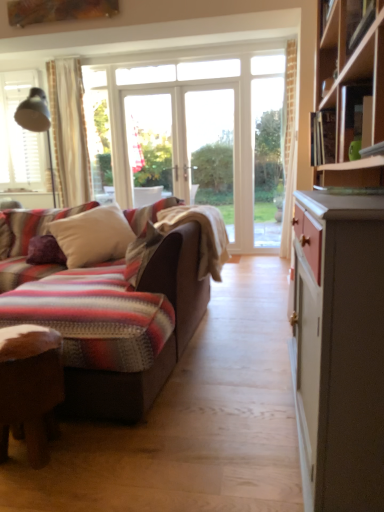
Describe the element at coordinates (93, 236) in the screenshot. I see `white soft pillow at center, the second pillow in the left-to-right sequence` at that location.

What do you see at coordinates (45, 251) in the screenshot? I see `purple velvet pillow at left, placed as the first pillow when sorted from left to right` at bounding box center [45, 251].

Measure the distance between point (x=51, y=258) and camera.

Point (x=51, y=258) is 3.05 meters away from camera.

The width and height of the screenshot is (384, 512). I want to click on striped woolen blanket at center, so click(x=201, y=234).

What is the approximate width of striped woolen blanket at center?

22.66 inches.

Identify the location of white soft pillow at center, acting as the 1th pillow starting from the right. This screenshot has height=512, width=384. (93, 236).

Is wooden desk at lower left further to the viewer compared to white soft pillow at center, the second pillow in the left-to-right sequence?

No, it is in front of white soft pillow at center, the second pillow in the left-to-right sequence.

Is white soft pillow at center, the second pillow in the left-to-right sequence, at the back of wooden desk at lower left?

Yes, wooden desk at lower left is positioned with its back facing white soft pillow at center, the second pillow in the left-to-right sequence.

Based on their sizes in the image, would you say wooden desk at lower left is bigger or smaller than white soft pillow at center, acting as the 1th pillow starting from the right?

Clearly, wooden desk at lower left is smaller in size than white soft pillow at center, acting as the 1th pillow starting from the right.

Is white soft pillow at center, acting as the 1th pillow starting from the right, completely or partially inside wooden desk at lower left?

No, white soft pillow at center, acting as the 1th pillow starting from the right, is not a part of wooden desk at lower left.

Between point (214, 215) and point (111, 231), which one is positioned behind?

Point (111, 231)

From the image's perspective, is striped woolen blanket at center located above or below white soft pillow at center, the second pillow in the left-to-right sequence?

Clearly, from the image's perspective, striped woolen blanket at center is below white soft pillow at center, the second pillow in the left-to-right sequence.

Is striped woolen blanket at center taller or shorter than white soft pillow at center, the second pillow in the left-to-right sequence?

striped woolen blanket at center is shorter than white soft pillow at center, the second pillow in the left-to-right sequence.

In the scene shown: Would you say striped woolen blanket at center is to the left or to the right of white soft pillow at center, the second pillow in the left-to-right sequence, in the picture?

From the image, it's evident that striped woolen blanket at center is to the right of white soft pillow at center, the second pillow in the left-to-right sequence.

Considering the sizes of objects wooden desk at lower left and purple velvet pillow at left, arranged as the second pillow when viewed from the right, in the image provided, who is thinner, wooden desk at lower left or purple velvet pillow at left, arranged as the second pillow when viewed from the right,?

wooden desk at lower left.

In the image, is wooden desk at lower left positioned in front of or behind purple velvet pillow at left, placed as the first pillow when sorted from left to right?

In the image, wooden desk at lower left appears in front of purple velvet pillow at left, placed as the first pillow when sorted from left to right.

Is wooden desk at lower left next to purple velvet pillow at left, placed as the first pillow when sorted from left to right?

No, wooden desk at lower left is not beside purple velvet pillow at left, placed as the first pillow when sorted from left to right.

Is wooden desk at lower left taller than purple velvet pillow at left, placed as the first pillow when sorted from left to right?

Indeed, wooden desk at lower left has a greater height compared to purple velvet pillow at left, placed as the first pillow when sorted from left to right.

Is purple velvet pillow at left, arranged as the second pillow when viewed from the right, not close to wooden desk at lower left?

Yes, purple velvet pillow at left, arranged as the second pillow when viewed from the right, is far from wooden desk at lower left.

Is purple velvet pillow at left, placed as the first pillow when sorted from left to right, positioned with its back to wooden desk at lower left?

purple velvet pillow at left, placed as the first pillow when sorted from left to right, does not have its back to wooden desk at lower left.

Where is `desk lying in front of the purple velvet pillow at left, arranged as the second pillow when viewed from the right`? This screenshot has width=384, height=512. desk lying in front of the purple velvet pillow at left, arranged as the second pillow when viewed from the right is located at coordinates (29, 387).

Based on the photo, which is correct: purple velvet pillow at left, arranged as the second pillow when viewed from the right, is inside wooden desk at lower left, or outside of it?

purple velvet pillow at left, arranged as the second pillow when viewed from the right, is not enclosed by wooden desk at lower left.

Is striped woolen blanket at center at the right side of wooden desk at lower left?

Correct, you'll find striped woolen blanket at center to the right of wooden desk at lower left.

How distant is striped woolen blanket at center from wooden desk at lower left?

1.18 meters.

Who is shorter, striped woolen blanket at center or wooden desk at lower left?

Standing shorter between the two is wooden desk at lower left.

From the image's perspective, is striped woolen blanket at center beneath wooden desk at lower left?

No.

Considering the relative sizes of purple velvet pillow at left, arranged as the second pillow when viewed from the right, and white soft pillow at center, acting as the 1th pillow starting from the right, in the image provided, is purple velvet pillow at left, arranged as the second pillow when viewed from the right, bigger than white soft pillow at center, acting as the 1th pillow starting from the right,?

No.

Between purple velvet pillow at left, arranged as the second pillow when viewed from the right, and white soft pillow at center, the second pillow in the left-to-right sequence, which one has more height?

Standing taller between the two is white soft pillow at center, the second pillow in the left-to-right sequence.

The height and width of the screenshot is (512, 384). Find the location of `pillow that is on the left side of white soft pillow at center, acting as the 1th pillow starting from the right`. pillow that is on the left side of white soft pillow at center, acting as the 1th pillow starting from the right is located at coordinates (45, 251).

Could you tell me if purple velvet pillow at left, placed as the first pillow when sorted from left to right, is facing white soft pillow at center, acting as the 1th pillow starting from the right?

Yes, purple velvet pillow at left, placed as the first pillow when sorted from left to right, is turned towards white soft pillow at center, acting as the 1th pillow starting from the right.

How many degrees apart are the facing directions of wooden desk at lower left and striped woolen blanket at center?

They differ by 85.4 degrees in their facing directions.

Based on the photo, can you confirm if wooden desk at lower left is bigger than striped woolen blanket at center?

Incorrect, wooden desk at lower left is not larger than striped woolen blanket at center.

The image size is (384, 512). Identify the location of desk beneath the striped woolen blanket at center (from a real-world perspective). (29, 387).

Is wooden desk at lower left not near striped woolen blanket at center?

wooden desk at lower left is positioned a significant distance from striped woolen blanket at center.

From a real-world perspective, which pillow is the 2nd one above the wooden desk at lower left? Please provide its 2D coordinates.

[(93, 236)]

Where is `blanket in front of the white soft pillow at center, the second pillow in the left-to-right sequence`? blanket in front of the white soft pillow at center, the second pillow in the left-to-right sequence is located at coordinates (201, 234).

Which object lies further to the anchor point striped woolen blanket at center, purple velvet pillow at left, arranged as the second pillow when viewed from the right, or wooden desk at lower left?

Based on the image, wooden desk at lower left appears to be further to striped woolen blanket at center.

When comparing their distances from purple velvet pillow at left, arranged as the second pillow when viewed from the right, does wooden desk at lower left or striped woolen blanket at center seem closer?

striped woolen blanket at center lies closer to purple velvet pillow at left, arranged as the second pillow when viewed from the right, than the other object.

Which object lies further to the anchor point purple velvet pillow at left, arranged as the second pillow when viewed from the right, wooden desk at lower left or white soft pillow at center, acting as the 1th pillow starting from the right?

The object further to purple velvet pillow at left, arranged as the second pillow when viewed from the right, is wooden desk at lower left.

Which object lies further to the anchor point striped woolen blanket at center, white soft pillow at center, acting as the 1th pillow starting from the right, or purple velvet pillow at left, placed as the first pillow when sorted from left to right?

The object further to striped woolen blanket at center is purple velvet pillow at left, placed as the first pillow when sorted from left to right.

From the image, which object appears to be nearer to purple velvet pillow at left, placed as the first pillow when sorted from left to right, striped woolen blanket at center or wooden desk at lower left?

striped woolen blanket at center is positioned closer to the anchor purple velvet pillow at left, placed as the first pillow when sorted from left to right.

Which object lies nearer to the anchor point white soft pillow at center, acting as the 1th pillow starting from the right, striped woolen blanket at center or purple velvet pillow at left, arranged as the second pillow when viewed from the right?

Among the two, purple velvet pillow at left, arranged as the second pillow when viewed from the right, is located nearer to white soft pillow at center, acting as the 1th pillow starting from the right.

Looking at the image, which one is located further to white soft pillow at center, acting as the 1th pillow starting from the right, striped woolen blanket at center or wooden desk at lower left?

Based on the image, wooden desk at lower left appears to be further to white soft pillow at center, acting as the 1th pillow starting from the right.

Considering their positions, is white soft pillow at center, the second pillow in the left-to-right sequence, positioned closer to striped woolen blanket at center than wooden desk at lower left?

Based on the image, white soft pillow at center, the second pillow in the left-to-right sequence, appears to be nearer to striped woolen blanket at center.

Identify the location of blanket between wooden desk at lower left and purple velvet pillow at left, placed as the first pillow when sorted from left to right, from front to back. [201, 234].

Where is `blanket between wooden desk at lower left and white soft pillow at center, the second pillow in the left-to-right sequence, along the z-axis`? This screenshot has height=512, width=384. blanket between wooden desk at lower left and white soft pillow at center, the second pillow in the left-to-right sequence, along the z-axis is located at coordinates (201, 234).

Where is `pillow between purple velvet pillow at left, placed as the first pillow when sorted from left to right, and striped woolen blanket at center, in the horizontal direction`? The width and height of the screenshot is (384, 512). pillow between purple velvet pillow at left, placed as the first pillow when sorted from left to right, and striped woolen blanket at center, in the horizontal direction is located at coordinates (93, 236).

Identify the location of pillow between wooden desk at lower left and purple velvet pillow at left, arranged as the second pillow when viewed from the right, from front to back. (93, 236).